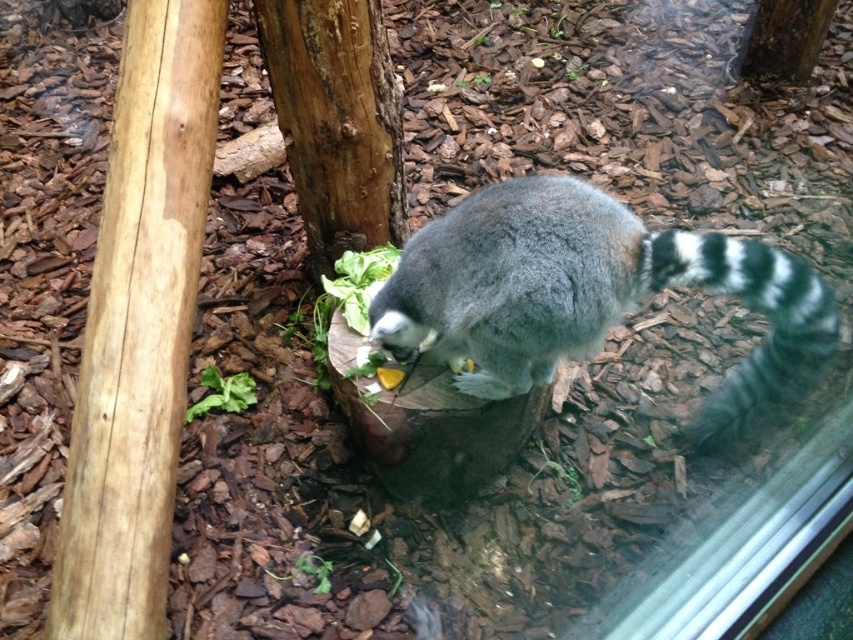
Is brown rough bark at center closer to the viewer compared to black and white striped tail at lower right?

No.

Measure the distance between brown rough bark at center and camera.

brown rough bark at center and camera are 2.05 meters apart.

Find the location of a particular element. brown rough bark at center is located at coordinates (335, 122).

Which is more to the left, gray fur lemur at center or brown rough bark at upper center?

gray fur lemur at center

Who is more distant from viewer, (715, 289) or (747, 68)?

The point (747, 68) is more distant.

What do you see at coordinates (592, 296) in the screenshot? The width and height of the screenshot is (853, 640). I see `gray fur lemur at center` at bounding box center [592, 296].

Where is `gray fur lemur at center`? gray fur lemur at center is located at coordinates (592, 296).

Who is higher up, black and white striped tail at lower right or brown rough bark at upper center?

brown rough bark at upper center is above.

How distant is black and white striped tail at lower right from brown rough bark at upper center?

black and white striped tail at lower right is 3.69 feet away from brown rough bark at upper center.

Describe the element at coordinates (753, 310) in the screenshot. I see `black and white striped tail at lower right` at that location.

Locate an element on the screen. black and white striped tail at lower right is located at coordinates (753, 310).